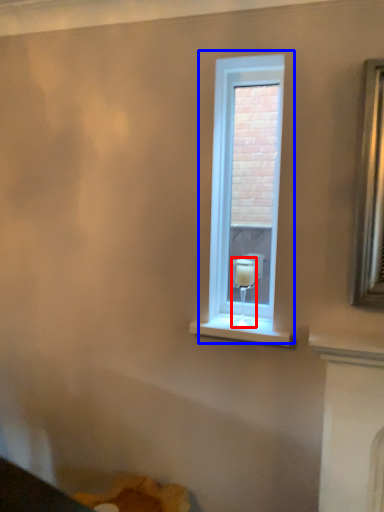
Question: Among these objects, which one is farthest to the camera, candle holder (highlighted by a red box) or window (highlighted by a blue box)?

Choices:
 (A) candle holder
 (B) window

Answer: (B)